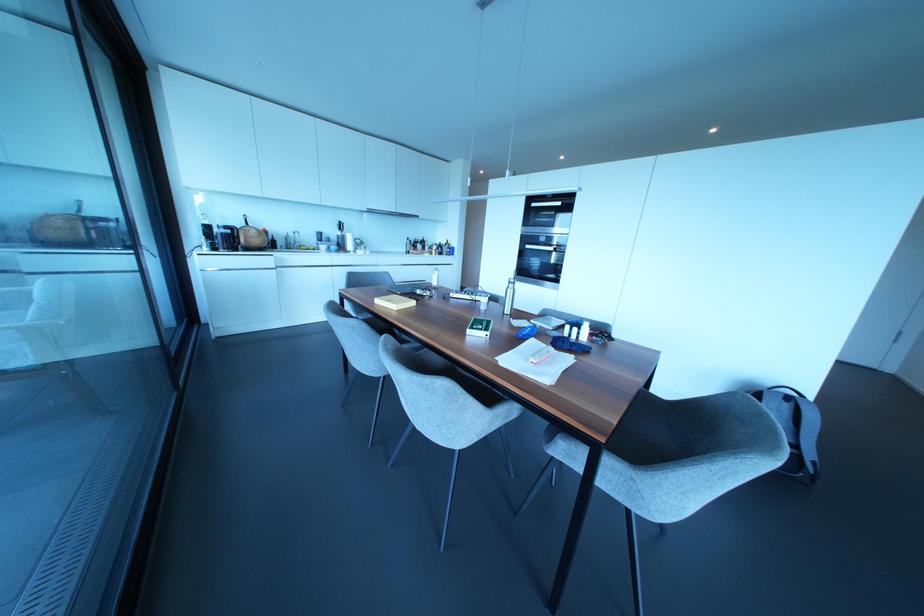
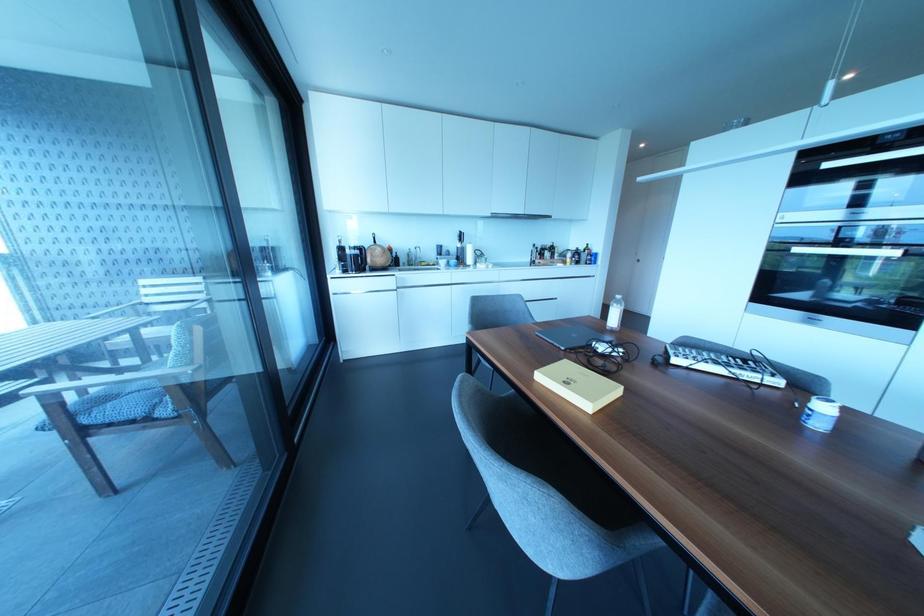
What movement of the cameraman would produce the second image?

The movement direction of the cameraman is left, forward.